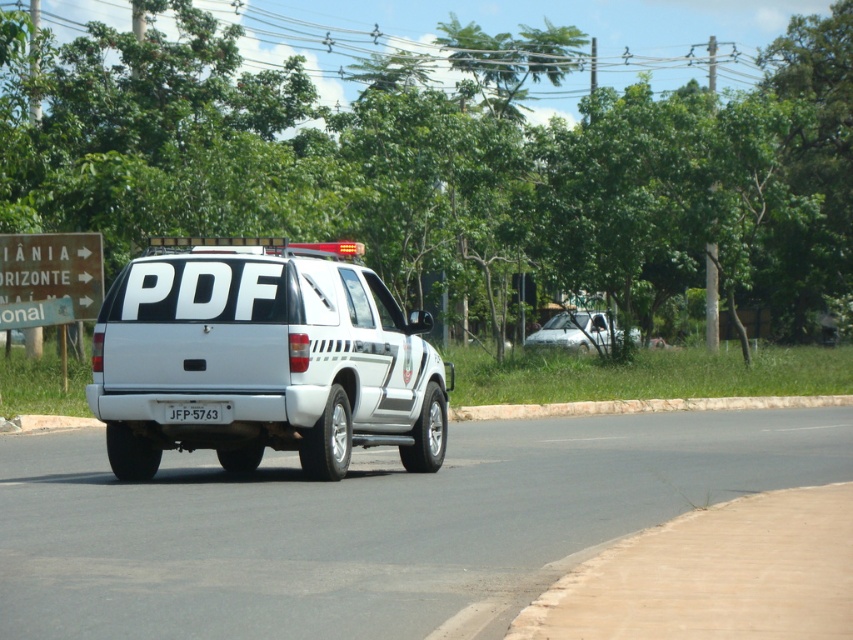
You are a parking attendant who needs to park the white matte suv at center and the white plastic license plate at center in two adjacent parking spots. The parking spots are exactly 1.8 meters wide. Can both vehicles fit side by side?

The white matte suv at center might be wider than white plastic license plate at center. Since the parking spots are 1.8 meters wide, it is uncertain if both can fit side by side without overlapping. The SUV may exceed the combined width required.

You are a pedestrian standing on the grassy area near the curb. You see the green wooden sign at upper left and the white plastic license plate at center. Which object is closer to you?

The green wooden sign at upper left is closer to you because it is further to the viewer than the white plastic license plate at center.

You are a driver approaching the white police vehicle at center. You see the green wooden sign at upper left and the white plastic license plate at center. Which object is located to the left of the other?

The green wooden sign at upper left is positioned on the left side of white plastic license plate at center.